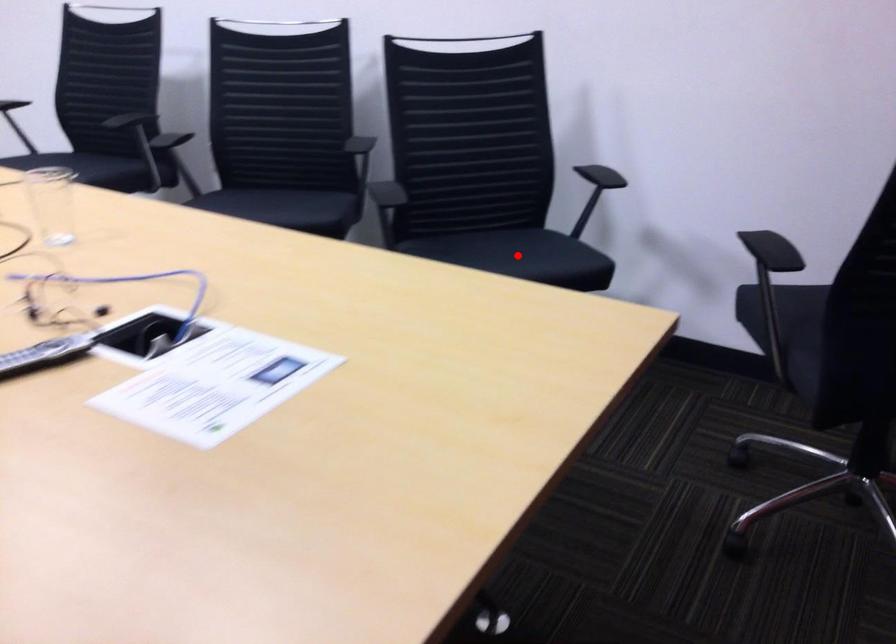
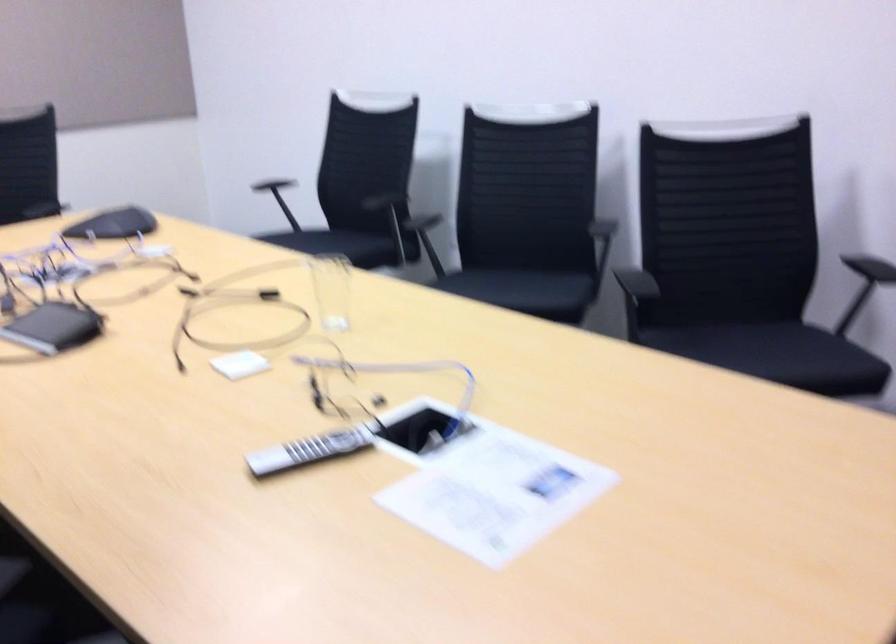
Question: I am providing you with two images of the same scene from different viewpoints. Image1 has a red point marked. In image2, the corresponding 3D location appears at what relative position? Reply with the corresponding letter.

Choices:
 (A) Closer
 (B) Farther

Answer: (A)